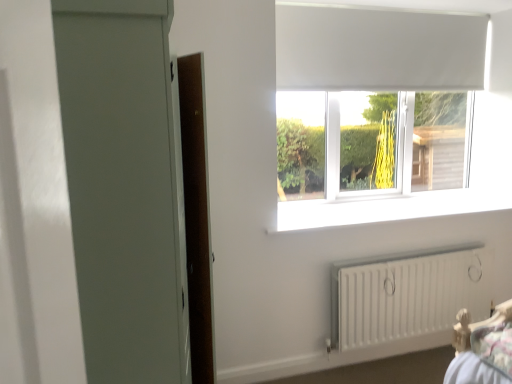
Question: From a real-world perspective, is white smooth window sill at center below matte gray screen door at left?

Choices:
 (A) no
 (B) yes

Answer: (B)

Question: Does white smooth window sill at center have a greater width compared to matte gray screen door at left?

Choices:
 (A) yes
 (B) no

Answer: (B)

Question: From a real-world perspective, is white smooth window sill at center located higher than matte gray screen door at left?

Choices:
 (A) yes
 (B) no

Answer: (B)

Question: From the image's perspective, does white smooth window sill at center appear higher than matte gray screen door at left?

Choices:
 (A) yes
 (B) no

Answer: (A)

Question: Considering the relative sizes of white smooth window sill at center and matte gray screen door at left in the image provided, is white smooth window sill at center shorter than matte gray screen door at left?

Choices:
 (A) yes
 (B) no

Answer: (A)

Question: From a real-world perspective, is white matte curtain at upper center positioned above or below matte gray screen door at left?

Choices:
 (A) above
 (B) below

Answer: (A)

Question: In terms of height, does white matte curtain at upper center look taller or shorter compared to matte gray screen door at left?

Choices:
 (A) tall
 (B) short

Answer: (B)

Question: Based on their positions, is white matte curtain at upper center located to the left or right of matte gray screen door at left?

Choices:
 (A) right
 (B) left

Answer: (A)

Question: From the image's perspective, relative to matte gray screen door at left, is white matte curtain at upper center above or below?

Choices:
 (A) below
 (B) above

Answer: (B)

Question: Is white matte window at upper center situated inside white matte curtain at upper center or outside?

Choices:
 (A) outside
 (B) inside

Answer: (B)

Question: From a real-world perspective, is white matte window at upper center above or below white matte curtain at upper center?

Choices:
 (A) above
 (B) below

Answer: (B)

Question: Relative to white matte curtain at upper center, is white matte window at upper center in front or behind?

Choices:
 (A) front
 (B) behind

Answer: (B)

Question: From the image's perspective, is white matte window at upper center located above or below white matte curtain at upper center?

Choices:
 (A) below
 (B) above

Answer: (A)

Question: From their relative heights in the image, would you say matte gray screen door at left is taller or shorter than white matte curtain at upper center?

Choices:
 (A) tall
 (B) short

Answer: (A)

Question: Is point (65, 97) closer or farther from the camera than point (408, 26)?

Choices:
 (A) farther
 (B) closer

Answer: (B)